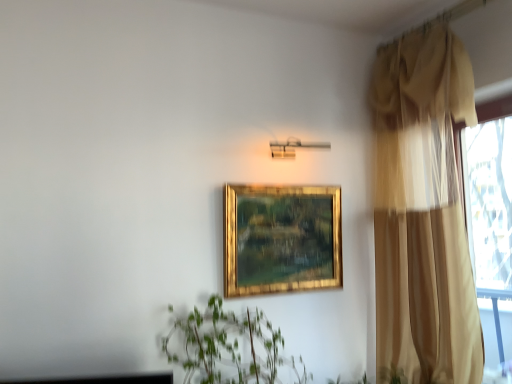
Question: From the image's perspective, is beige sheer curtain at right below gold/gilded picture frame at center?

Choices:
 (A) no
 (B) yes

Answer: (A)

Question: Is gold/gilded picture frame at center surrounded by beige sheer curtain at right?

Choices:
 (A) yes
 (B) no

Answer: (B)

Question: Is beige sheer curtain at right closer to the viewer compared to gold/gilded picture frame at center?

Choices:
 (A) yes
 (B) no

Answer: (A)

Question: Does beige sheer curtain at right have a lesser height compared to gold/gilded picture frame at center?

Choices:
 (A) no
 (B) yes

Answer: (A)

Question: Are beige sheer curtain at right and gold/gilded picture frame at center located far from each other?

Choices:
 (A) yes
 (B) no

Answer: (B)

Question: Is beige sheer curtain at right behind gold/gilded picture frame at center?

Choices:
 (A) no
 (B) yes

Answer: (A)

Question: Can you confirm if gold/gilded picture frame at center is smaller than beige sheer curtain at right?

Choices:
 (A) yes
 (B) no

Answer: (A)

Question: From a real-world perspective, is gold/gilded picture frame at center beneath beige sheer curtain at right?

Choices:
 (A) no
 (B) yes

Answer: (B)

Question: Is the depth of gold/gilded picture frame at center less than that of beige sheer curtain at right?

Choices:
 (A) yes
 (B) no

Answer: (B)

Question: Is gold/gilded picture frame at center far from beige sheer curtain at right?

Choices:
 (A) yes
 (B) no

Answer: (B)

Question: Is the position of gold/gilded picture frame at center more distant than that of beige sheer curtain at right?

Choices:
 (A) no
 (B) yes

Answer: (B)

Question: Considering the relative sizes of gold/gilded picture frame at center and beige sheer curtain at right in the image provided, is gold/gilded picture frame at center wider than beige sheer curtain at right?

Choices:
 (A) no
 (B) yes

Answer: (A)

Question: Considering the positions of gold/gilded picture frame at center and beige sheer curtain at right in the image, is gold/gilded picture frame at center taller or shorter than beige sheer curtain at right?

Choices:
 (A) tall
 (B) short

Answer: (B)